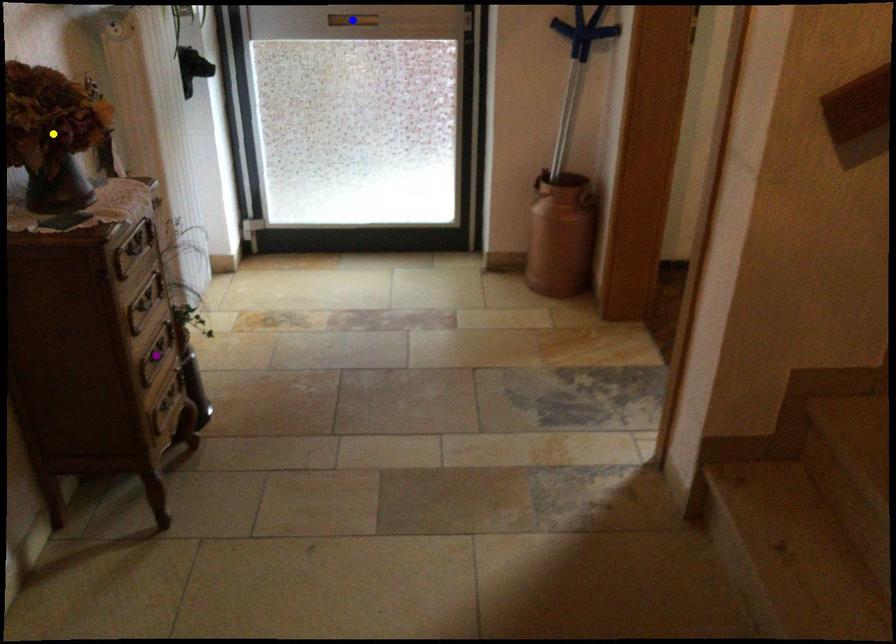
In the scene shown: Order these from nearest to farthest:
blue point
purple point
yellow point

1. yellow point
2. purple point
3. blue point